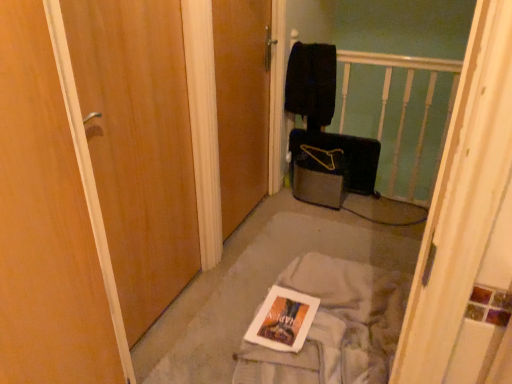
Question: Is white fabric at center turned away from wooden door at left, which is the first door in left-to-right order?

Choices:
 (A) yes
 (B) no

Answer: (B)

Question: Is white fabric at center to the left of wooden door at left, which is the first door in left-to-right order, from the viewer's perspective?

Choices:
 (A) yes
 (B) no

Answer: (B)

Question: From the image's perspective, is white fabric at center beneath wooden door at left, which is the first door in left-to-right order?

Choices:
 (A) no
 (B) yes

Answer: (B)

Question: Does white fabric at center contain wooden door at left, the 2th door in the right-to-left sequence?

Choices:
 (A) no
 (B) yes

Answer: (A)

Question: Can you confirm if white fabric at center is bigger than wooden door at left, which is the first door in left-to-right order?

Choices:
 (A) no
 (B) yes

Answer: (A)

Question: Based on their positions, is white fabric at center located to the left or right of wooden door at left, which is the first door in left-to-right order?

Choices:
 (A) left
 (B) right

Answer: (B)

Question: Is white fabric at center wider or thinner than wooden door at left, which is the first door in left-to-right order?

Choices:
 (A) thin
 (B) wide

Answer: (B)

Question: Based on their sizes in the image, would you say white fabric at center is bigger or smaller than wooden door at left, the 2th door in the right-to-left sequence?

Choices:
 (A) small
 (B) big

Answer: (B)

Question: Is white fabric at center inside the boundaries of wooden door at left, which is the first door in left-to-right order, or outside?

Choices:
 (A) outside
 (B) inside

Answer: (A)

Question: From the image's perspective, relative to wooden door at left, which is the first door in left-to-right order, is wooden door at center, placed as the 2th door when sorted from left to right, above or below?

Choices:
 (A) above
 (B) below

Answer: (A)

Question: Based on their positions, is wooden door at center, which is the 1th door from right to left, located to the left or right of wooden door at left, which is the first door in left-to-right order?

Choices:
 (A) left
 (B) right

Answer: (B)

Question: From a real-world perspective, relative to wooden door at left, which is the first door in left-to-right order, is wooden door at center, which is the 1th door from right to left, vertically above or below?

Choices:
 (A) above
 (B) below

Answer: (B)

Question: Is wooden door at center, which is the 1th door from right to left, bigger or smaller than wooden door at left, which is the first door in left-to-right order?

Choices:
 (A) small
 (B) big

Answer: (B)

Question: Is point (298, 253) positioned closer to the camera than point (310, 302)?

Choices:
 (A) closer
 (B) farther

Answer: (B)

Question: Considering the positions of white fabric at center and white glossy magazine at center in the image, is white fabric at center wider or thinner than white glossy magazine at center?

Choices:
 (A) thin
 (B) wide

Answer: (B)